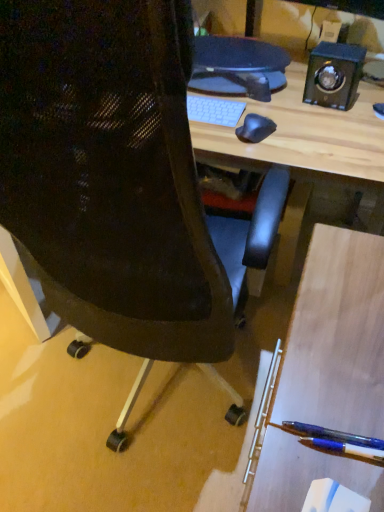
Question: Would you say blue glossy pen at lower right is outside black mesh chair at center?

Choices:
 (A) yes
 (B) no

Answer: (A)

Question: Is blue glossy pen at lower right positioned behind black mesh chair at center?

Choices:
 (A) yes
 (B) no

Answer: (A)

Question: Would you say black mesh chair at center is part of blue glossy pen at lower right's contents?

Choices:
 (A) yes
 (B) no

Answer: (B)

Question: From the image's perspective, is blue glossy pen at lower right located beneath black mesh chair at center?

Choices:
 (A) yes
 (B) no

Answer: (A)

Question: Can you confirm if blue glossy pen at lower right is taller than black mesh chair at center?

Choices:
 (A) no
 (B) yes

Answer: (A)

Question: Relative to black polished wood speaker at upper right, is blue glossy pen at lower right in front or behind?

Choices:
 (A) behind
 (B) front

Answer: (B)

Question: Based on their sizes in the image, would you say blue glossy pen at lower right is bigger or smaller than black polished wood speaker at upper right?

Choices:
 (A) big
 (B) small

Answer: (B)

Question: Looking at their shapes, would you say blue glossy pen at lower right is wider or thinner than black polished wood speaker at upper right?

Choices:
 (A) thin
 (B) wide

Answer: (B)

Question: Is blue glossy pen at lower right taller or shorter than black polished wood speaker at upper right?

Choices:
 (A) short
 (B) tall

Answer: (A)

Question: From the image's perspective, is black polished wood speaker at upper right above or below blue glossy pen at lower right?

Choices:
 (A) below
 (B) above

Answer: (B)

Question: Is point (334, 42) positioned closer to the camera than point (321, 443)?

Choices:
 (A) farther
 (B) closer

Answer: (A)

Question: In terms of height, does black polished wood speaker at upper right look taller or shorter compared to blue glossy pen at lower right?

Choices:
 (A) tall
 (B) short

Answer: (A)

Question: In terms of width, does black polished wood speaker at upper right look wider or thinner when compared to blue glossy pen at lower right?

Choices:
 (A) thin
 (B) wide

Answer: (A)

Question: Does point (354, 436) appear closer or farther from the camera than point (337, 42)?

Choices:
 (A) farther
 (B) closer

Answer: (B)

Question: In terms of height, does translucent blue pen at lower right look taller or shorter compared to black polished wood speaker at upper right?

Choices:
 (A) tall
 (B) short

Answer: (B)